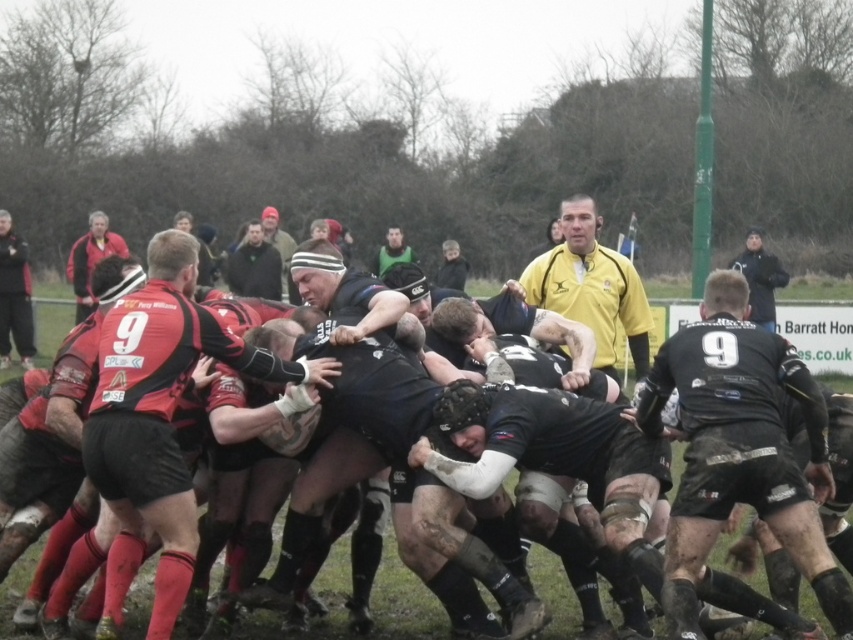
Looking at this image, you are a referee observing the rugby scrum. You notice a point marked at coordinates [590,285] on the field. What is the position of the yellow jersey at center relative to this point?

The point [590,285] corresponds exactly to the yellow jersey at center.

From the picture: You are a photographer trying to capture both the dark gray sweater at upper center and the green matte jersey at center in a single shot. Considering their sizes, which object would you need to position closer to the camera to ensure both fit in the frame?

The dark gray sweater at upper center has a smaller width than the green matte jersey at center. To ensure both fit in the frame, position the dark gray sweater at upper center closer to the camera since it is smaller, allowing it to appear larger in the photo and balance the sizes within the frame.